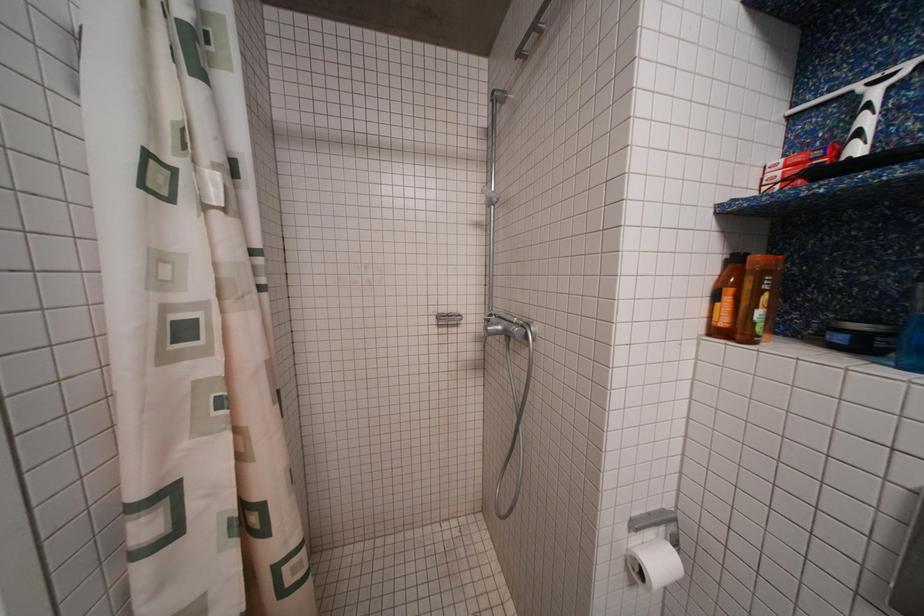
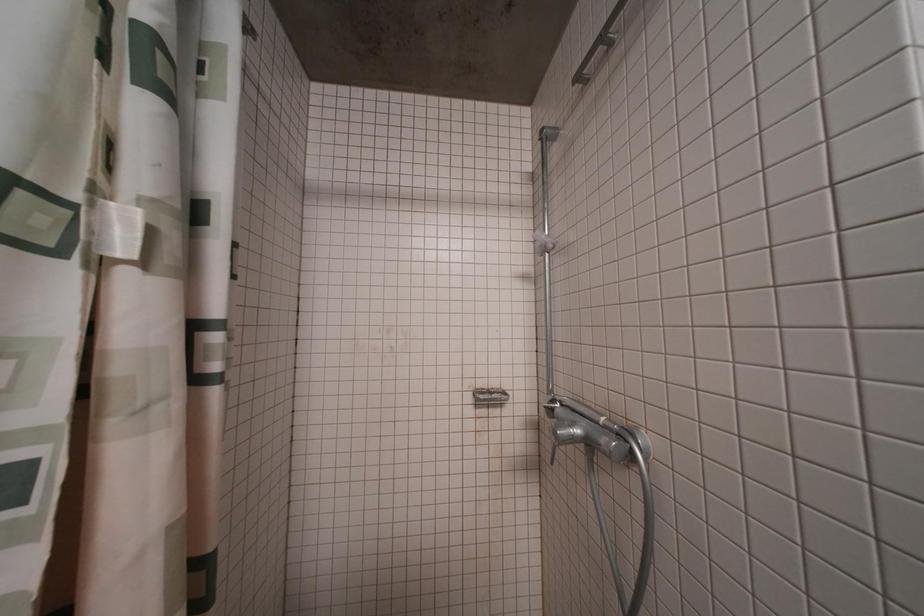
Question: Which direction would the cameraman need to move to produce the second image? Reply with the corresponding letter.

Choices:
 (A) Left
 (B) Right
 (C) Forward
 (D) Backward

Answer: (C)